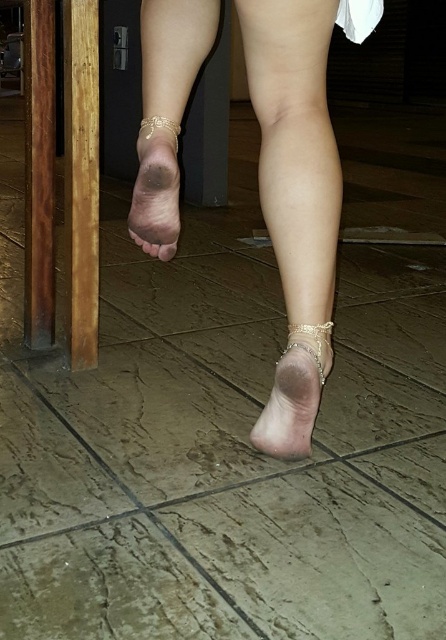
Is point (145, 109) positioned after point (165, 202)?

No, it is not.

Does point (155, 76) come closer to viewer compared to point (144, 230)?

Yes, point (155, 76) is in front of point (144, 230).

Which is behind, point (133, 211) or point (173, 186)?

The point (133, 211) is behind.

You are a GUI agent. You are given a task and a screenshot of the screen. Output one action in this format:
    pyautogui.click(x=<x>, y=<y>)
    Task: Click on the matte gold anklet at center
    
    Given the screenshot: What is the action you would take?
    pyautogui.click(x=165, y=109)

Is gold metallic sandal at lower center bigger than pink matte toe at center?

Yes.

Can you confirm if gold metallic sandal at lower center is positioned above pink matte toe at center?

No, gold metallic sandal at lower center is not above pink matte toe at center.

Is point (298, 353) positioned after point (172, 253)?

No, it is in front of (172, 253).

At what (x,y) coordinates should I click in order to perform the action: click on gold metallic sandal at lower center. Please return your answer as a coordinate pair (x, y). Looking at the image, I should click on (294, 394).

Is gold metallic sandal at lower center wider than dry skin at center?

Yes.

Does gold metallic sandal at lower center appear on the left side of dry skin at center?

No, gold metallic sandal at lower center is not to the left of dry skin at center.

What do you see at coordinates (294, 394) in the screenshot?
I see `gold metallic sandal at lower center` at bounding box center [294, 394].

Where is `gold metallic sandal at lower center`? Image resolution: width=446 pixels, height=640 pixels. gold metallic sandal at lower center is located at coordinates (294, 394).